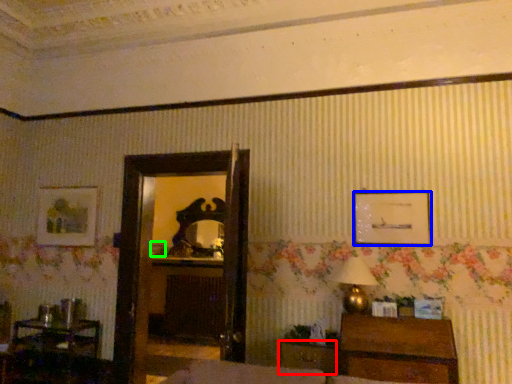
Question: Estimate the real-world distances between objects in this image. Which object is farther from drawer (highlighted by a red box), picture frame (highlighted by a blue box) or picture frame (highlighted by a green box)?

Choices:
 (A) picture frame
 (B) picture frame

Answer: (B)